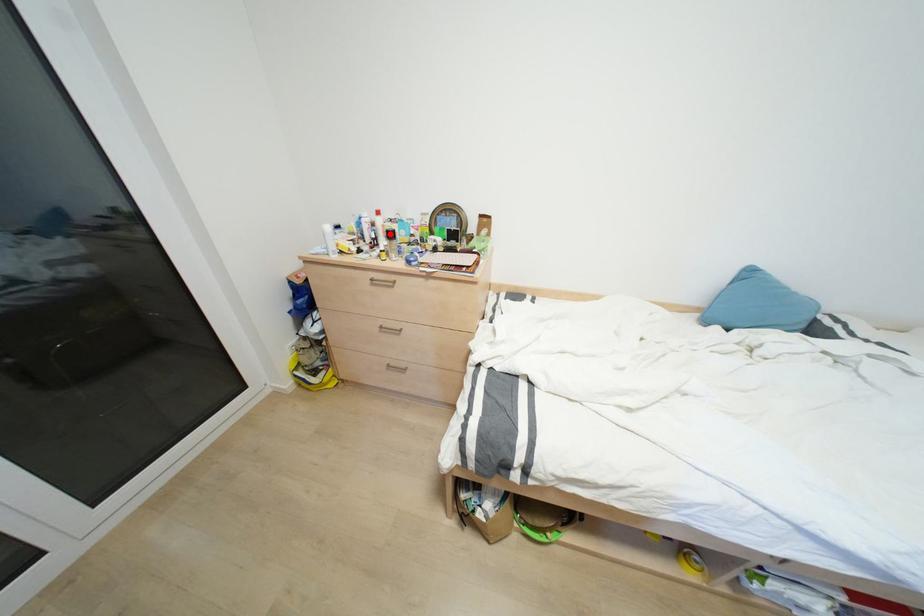
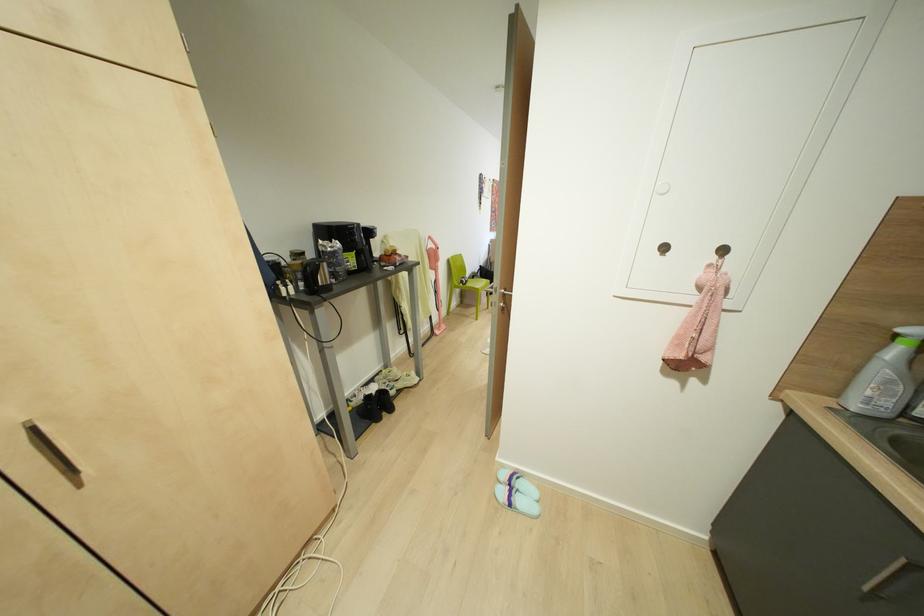
Question: I am providing you with two images of the same scene from different viewpoints. A red point is marked on the first image. Is the red point's position out of view in image 2?

Choices:
 (A) Yes
 (B) No

Answer: (A)